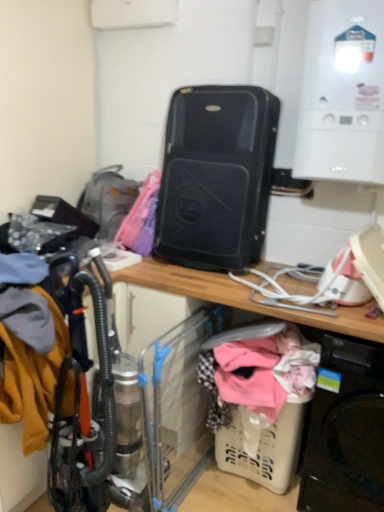
Question: Visually, is black plastic suitcase at center positioned to the left or to the right of black plastic washing machine at lower right?

Choices:
 (A) left
 (B) right

Answer: (A)

Question: Is black plastic suitcase at center situated inside black plastic washing machine at lower right or outside?

Choices:
 (A) inside
 (B) outside

Answer: (B)

Question: Which object is the closest to the black plastic suitcase at center?

Choices:
 (A) black matte suitcase at center
 (B) black plastic washing machine at lower right
 (C) matte gray backpack at left
 (D) white glossy boiler at upper right
 (E) plastic/transparent baby carriage at lower center

Answer: (A)

Question: Which is farther from the white glossy boiler at upper right?

Choices:
 (A) black matte suitcase at center
 (B) black plastic washing machine at lower right
 (C) black plastic suitcase at center
 (D) matte gray backpack at left
 (E) plastic/transparent baby carriage at lower center

Answer: (D)